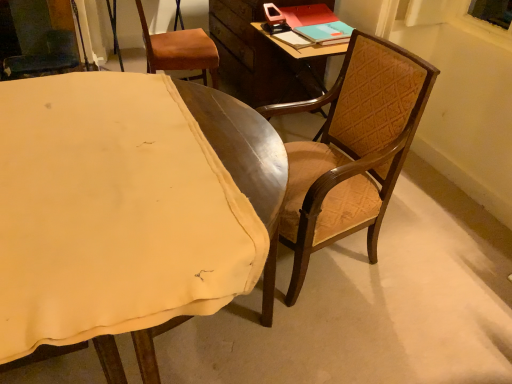
Image resolution: width=512 pixels, height=384 pixels. Describe the element at coordinates (326, 33) in the screenshot. I see `teal matte book at upper right` at that location.

I want to click on brown leather chair at upper left, positioned as the 3th chair in front-to-back order, so click(180, 51).

Identify the location of wooden chair at right, which is the third chair from back to front. (127, 207).

You are a GUI agent. You are given a task and a screenshot of the screen. Output one action in this format:
    pyautogui.click(x=<x>, y=<y>)
    Task: Click on the teal matte book at upper right
    This screenshot has width=512, height=384.
    Given the screenshot: What is the action you would take?
    pyautogui.click(x=326, y=33)

Based on the photo, is wooden chair at center, positioned as the second chair in front-to-back order, turned away from teal matte book at upper right?

wooden chair at center, positioned as the second chair in front-to-back order, does not have its back to teal matte book at upper right.

Are wooden chair at center, positioned as the second chair in front-to-back order, and teal matte book at upper right located far from each other?

They are positioned close to each other.

From the image's perspective, is wooden chair at center, which is counted as the 2th chair, starting from the back, positioned above or below teal matte book at upper right?

wooden chair at center, which is counted as the 2th chair, starting from the back, is situated lower than teal matte book at upper right in the image.

Considering the positions of objects wooden chair at right, which is the third chair from back to front, and wooden chair at center, which is counted as the 2th chair, starting from the back, in the image provided, who is in front, wooden chair at right, which is the third chair from back to front, or wooden chair at center, which is counted as the 2th chair, starting from the back,?

wooden chair at right, which is the third chair from back to front, is more forward.

What's the angular difference between wooden chair at right, which is the third chair from back to front, and wooden chair at center, positioned as the second chair in front-to-back order,'s facing directions?

The facing directions of wooden chair at right, which is the third chair from back to front, and wooden chair at center, positioned as the second chair in front-to-back order, are 92.5 degrees apart.

Can you confirm if wooden chair at right, which is the third chair from back to front, is smaller than wooden chair at center, which is counted as the 2th chair, starting from the back?

Actually, wooden chair at right, which is the third chair from back to front, might be larger than wooden chair at center, which is counted as the 2th chair, starting from the back.

Is teal matte book at upper right completely or partially outside of wooden chair at center, which is counted as the 2th chair, starting from the back?

Yes, teal matte book at upper right is outside of wooden chair at center, which is counted as the 2th chair, starting from the back.

Consider the image. Considering the sizes of teal matte book at upper right and wooden chair at center, which is counted as the 2th chair, starting from the back, in the image, is teal matte book at upper right wider or thinner than wooden chair at center, which is counted as the 2th chair, starting from the back,?

teal matte book at upper right is thinner than wooden chair at center, which is counted as the 2th chair, starting from the back.

From the image's perspective, would you say teal matte book at upper right is positioned over wooden chair at center, which is counted as the 2th chair, starting from the back?

Yes, from the image's perspective, teal matte book at upper right is over wooden chair at center, which is counted as the 2th chair, starting from the back.

Is wooden chair at center, which is counted as the 2th chair, starting from the back, oriented towards wooden chair at right, the first chair positioned from the front?

Yes, wooden chair at center, which is counted as the 2th chair, starting from the back, faces towards wooden chair at right, the first chair positioned from the front.

Considering the relative sizes of wooden chair at center, positioned as the second chair in front-to-back order, and wooden chair at right, which is the third chair from back to front, in the image provided, is wooden chair at center, positioned as the second chair in front-to-back order, shorter than wooden chair at right, which is the third chair from back to front,?

Incorrect, the height of wooden chair at center, positioned as the second chair in front-to-back order, does not fall short of that of wooden chair at right, which is the third chair from back to front.

In terms of width, does wooden chair at center, positioned as the second chair in front-to-back order, look wider or thinner when compared to wooden chair at right, the first chair positioned from the front?

wooden chair at center, positioned as the second chair in front-to-back order, is thinner than wooden chair at right, the first chair positioned from the front.

Considering the relative sizes of brown leather chair at upper left, positioned as the first chair in back-to-front order, and teal matte book at upper right in the image provided, is brown leather chair at upper left, positioned as the first chair in back-to-front order, taller than teal matte book at upper right?

Yes.

Does point (167, 51) appear closer or farther from the camera than point (327, 29)?

Clearly, point (167, 51) is more distant from the camera than point (327, 29).

Between wooden chair at right, which is the third chair from back to front, and teal matte book at upper right, which one appears on the right side from the viewer's perspective?

Positioned to the right is teal matte book at upper right.

Which object is closer to the camera taking this photo, wooden chair at right, the first chair positioned from the front, or teal matte book at upper right?

wooden chair at right, the first chair positioned from the front, is in front.

Between wooden chair at right, which is the third chair from back to front, and teal matte book at upper right, which one has more height?

Standing taller between the two is wooden chair at right, which is the third chair from back to front.

Is brown leather chair at upper left, positioned as the first chair in back-to-front order, in front of or behind wooden chair at center, which is counted as the 2th chair, starting from the back, in the image?

brown leather chair at upper left, positioned as the first chair in back-to-front order, is positioned farther from the viewer than wooden chair at center, which is counted as the 2th chair, starting from the back.

Considering the relative positions of brown leather chair at upper left, positioned as the 3th chair in front-to-back order, and wooden chair at center, which is counted as the 2th chair, starting from the back, in the image provided, is brown leather chair at upper left, positioned as the 3th chair in front-to-back order, to the left of wooden chair at center, which is counted as the 2th chair, starting from the back, from the viewer's perspective?

Correct, you'll find brown leather chair at upper left, positioned as the 3th chair in front-to-back order, to the left of wooden chair at center, which is counted as the 2th chair, starting from the back.

Considering the sizes of objects brown leather chair at upper left, positioned as the first chair in back-to-front order, and wooden chair at center, which is counted as the 2th chair, starting from the back, in the image provided, who is bigger, brown leather chair at upper left, positioned as the first chair in back-to-front order, or wooden chair at center, which is counted as the 2th chair, starting from the back,?

With larger size is wooden chair at center, which is counted as the 2th chair, starting from the back.

From the image's perspective, is brown leather chair at upper left, positioned as the 3th chair in front-to-back order, above wooden chair at center, which is counted as the 2th chair, starting from the back?

Yes, from the image's perspective, brown leather chair at upper left, positioned as the 3th chair in front-to-back order, is over wooden chair at center, which is counted as the 2th chair, starting from the back.

Which chair is the 1st one when counting from the front of the teal matte book at upper right? Please provide its 2D coordinates.

[(352, 150)]

Locate an element on the screen. The width and height of the screenshot is (512, 384). chair that is the 1st one when counting backward from the wooden chair at right, the first chair positioned from the front is located at coordinates (352, 150).

From the image, which object appears to be nearer to teal matte book at upper right, brown leather chair at upper left, positioned as the first chair in back-to-front order, or wooden chair at center, positioned as the second chair in front-to-back order?

wooden chair at center, positioned as the second chair in front-to-back order.

Based on their spatial positions, is teal matte book at upper right or wooden chair at center, which is counted as the 2th chair, starting from the back, further from wooden chair at right, the first chair positioned from the front?

teal matte book at upper right is positioned further to the anchor wooden chair at right, the first chair positioned from the front.

Considering their positions, is wooden chair at right, the first chair positioned from the front, positioned further to brown leather chair at upper left, positioned as the 3th chair in front-to-back order, than teal matte book at upper right?

Based on the image, wooden chair at right, the first chair positioned from the front, appears to be further to brown leather chair at upper left, positioned as the 3th chair in front-to-back order.

Considering their positions, is wooden chair at center, positioned as the second chair in front-to-back order, positioned closer to brown leather chair at upper left, positioned as the 3th chair in front-to-back order, than teal matte book at upper right?

Among the two, teal matte book at upper right is located nearer to brown leather chair at upper left, positioned as the 3th chair in front-to-back order.

When comparing their distances from wooden chair at center, positioned as the second chair in front-to-back order, does brown leather chair at upper left, positioned as the first chair in back-to-front order, or wooden chair at right, the first chair positioned from the front, seem further?

brown leather chair at upper left, positioned as the first chair in back-to-front order, is further to wooden chair at center, positioned as the second chair in front-to-back order.

Looking at this image, which object lies nearer to the anchor point wooden chair at center, which is counted as the 2th chair, starting from the back, teal matte book at upper right or brown leather chair at upper left, positioned as the 3th chair in front-to-back order?

Among the two, teal matte book at upper right is located nearer to wooden chair at center, which is counted as the 2th chair, starting from the back.

Which object lies further to the anchor point brown leather chair at upper left, positioned as the first chair in back-to-front order, wooden chair at right, which is the third chair from back to front, or wooden chair at center, positioned as the second chair in front-to-back order?

wooden chair at right, which is the third chair from back to front.

Considering their positions, is teal matte book at upper right positioned closer to brown leather chair at upper left, positioned as the 3th chair in front-to-back order, than wooden chair at center, positioned as the second chair in front-to-back order?

teal matte book at upper right.

The image size is (512, 384). I want to click on chair positioned between wooden chair at right, the first chair positioned from the front, and brown leather chair at upper left, positioned as the 3th chair in front-to-back order, from near to far, so click(x=352, y=150).

Find the location of a particular element. The image size is (512, 384). book between wooden chair at right, which is the third chair from back to front, and brown leather chair at upper left, positioned as the 3th chair in front-to-back order, in the front-back direction is located at coordinates (x=326, y=33).

Where is `chair between wooden chair at right, which is the third chair from back to front, and teal matte book at upper right from front to back`? chair between wooden chair at right, which is the third chair from back to front, and teal matte book at upper right from front to back is located at coordinates (352, 150).

Find the location of a particular element. This screenshot has width=512, height=384. book between wooden chair at center, positioned as the second chair in front-to-back order, and brown leather chair at upper left, positioned as the first chair in back-to-front order, in the front-back direction is located at coordinates (326, 33).